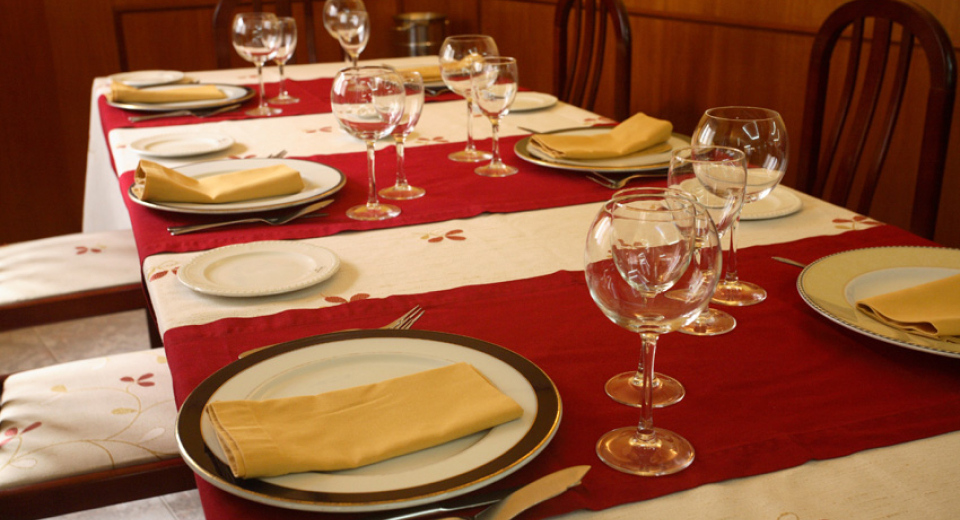
Where is `chargers`? chargers is located at coordinates (348, 363), (283, 207), (192, 110), (443, 84), (649, 168), (899, 341).